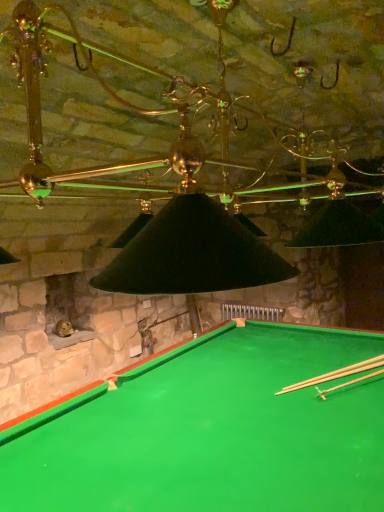
Question: Can you confirm if light brown wooden cue at bottom right, which is counted as the 1th cue, starting from the front, is positioned to the left of green felt billiard table at lower center?

Choices:
 (A) yes
 (B) no

Answer: (B)

Question: Could you tell me if light brown wooden cue at bottom right, which is counted as the 1th cue, starting from the front, is facing green felt billiard table at lower center?

Choices:
 (A) yes
 (B) no

Answer: (A)

Question: Considering the relative sizes of light brown wooden cue at bottom right, which is counted as the 1th cue, starting from the front, and green felt billiard table at lower center in the image provided, is light brown wooden cue at bottom right, which is counted as the 1th cue, starting from the front, wider than green felt billiard table at lower center?

Choices:
 (A) yes
 (B) no

Answer: (B)

Question: Is light brown wooden cue at bottom right, which is counted as the 1th cue, starting from the front, not within green felt billiard table at lower center?

Choices:
 (A) yes
 (B) no

Answer: (B)

Question: Can you confirm if light brown wooden cue at bottom right, placed as the 2th cue when sorted from back to front, is thinner than green felt billiard table at lower center?

Choices:
 (A) no
 (B) yes

Answer: (B)

Question: From a real-world perspective, relative to green felt billiard table at lower center, is light brown wooden cue at bottom right, which is counted as the 1th cue, starting from the front, vertically above or below?

Choices:
 (A) above
 (B) below

Answer: (A)

Question: In terms of size, does light brown wooden cue at bottom right, which is counted as the 1th cue, starting from the front, appear bigger or smaller than green felt billiard table at lower center?

Choices:
 (A) big
 (B) small

Answer: (B)

Question: Choose the correct answer: Is light brown wooden cue at bottom right, which is counted as the 1th cue, starting from the front, inside green felt billiard table at lower center or outside it?

Choices:
 (A) inside
 (B) outside

Answer: (A)

Question: From the image's perspective, is light brown wooden cue at bottom right, which is counted as the 1th cue, starting from the front, located above or below green felt billiard table at lower center?

Choices:
 (A) below
 (B) above

Answer: (B)

Question: Visually, is smooth wood cue at bottom right, arranged as the first cue when viewed from the back, positioned to the left or to the right of green felt billiard table at lower center?

Choices:
 (A) left
 (B) right

Answer: (B)

Question: Is point (362, 366) closer or farther from the camera than point (279, 375)?

Choices:
 (A) closer
 (B) farther

Answer: (B)

Question: Looking at their shapes, would you say smooth wood cue at bottom right, the 2th cue from the front, is wider or thinner than green felt billiard table at lower center?

Choices:
 (A) thin
 (B) wide

Answer: (A)

Question: From the image's perspective, is smooth wood cue at bottom right, arranged as the first cue when viewed from the back, located above or below green felt billiard table at lower center?

Choices:
 (A) above
 (B) below

Answer: (A)

Question: From a real-world perspective, relative to light brown wooden cue at bottom right, which is counted as the 1th cue, starting from the front, is smooth wood cue at bottom right, the 2th cue from the front, vertically above or below?

Choices:
 (A) below
 (B) above

Answer: (A)

Question: From the image's perspective, is smooth wood cue at bottom right, arranged as the first cue when viewed from the back, positioned above or below light brown wooden cue at bottom right, which is counted as the 1th cue, starting from the front?

Choices:
 (A) below
 (B) above

Answer: (A)